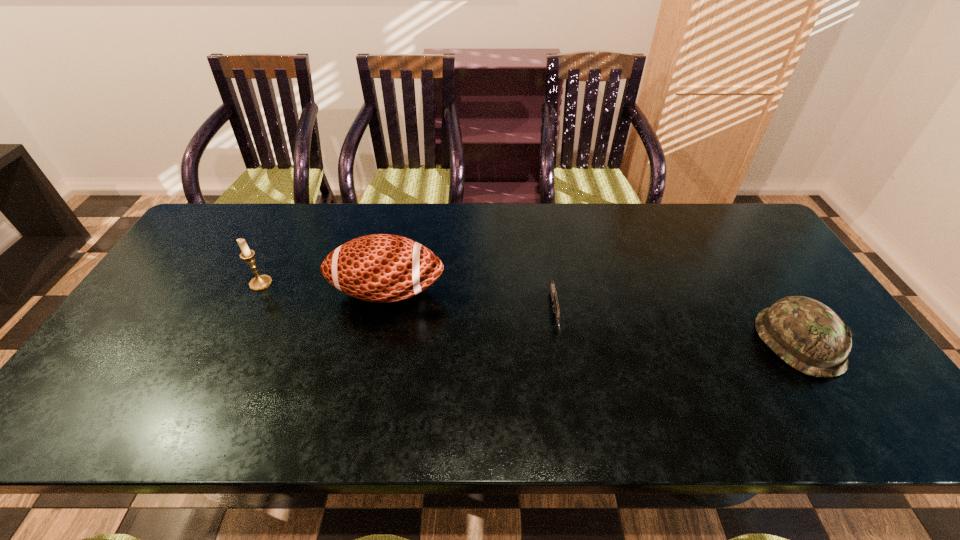
You are a GUI agent. You are given a task and a screenshot of the screen. Output one action in this format:
    pyautogui.click(x=<x>, y=<y>)
    Task: Click on the second object from left to right
    The height and width of the screenshot is (540, 960).
    Given the screenshot: What is the action you would take?
    pyautogui.click(x=381, y=267)

I want to click on candle holder, so click(x=260, y=282).

Locate an element on the screen. This screenshot has width=960, height=540. the rightmost object is located at coordinates (806, 334).

Find the location of a particular element. The height and width of the screenshot is (540, 960). headwear is located at coordinates (806, 334).

You are a GUI agent. You are given a task and a screenshot of the screen. Output one action in this format:
    pyautogui.click(x=<x>, y=<y>)
    Task: Click on the third object from left to right
    
    Given the screenshot: What is the action you would take?
    pyautogui.click(x=554, y=299)

You are a GUI agent. You are given a task and a screenshot of the screen. Output one action in this format:
    pyautogui.click(x=<x>, y=<y>)
    Task: Click on the gun
    Image resolution: width=960 pixels, height=540 pixels.
    Given the screenshot: What is the action you would take?
    pyautogui.click(x=554, y=299)

Locate an element on the screen. blank area located on the front of the football is located at coordinates (373, 360).

The height and width of the screenshot is (540, 960). I want to click on vacant area located 0.330m on the back of the leftmost object, so tap(299, 210).

The height and width of the screenshot is (540, 960). Identify the location of vacant area situated on the left of the headwear. 666,342.

Find the location of `vacant position located aimed along the barrel of the gun`. vacant position located aimed along the barrel of the gun is located at coordinates (565, 381).